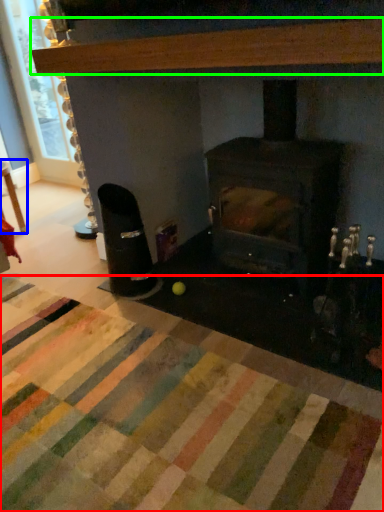
Question: Estimate the real-world distances between objects in this image. Which object is closer to mat (highlighted by a red box), table (highlighted by a blue box) or hardwood (highlighted by a green box)?

Choices:
 (A) table
 (B) hardwood

Answer: (B)